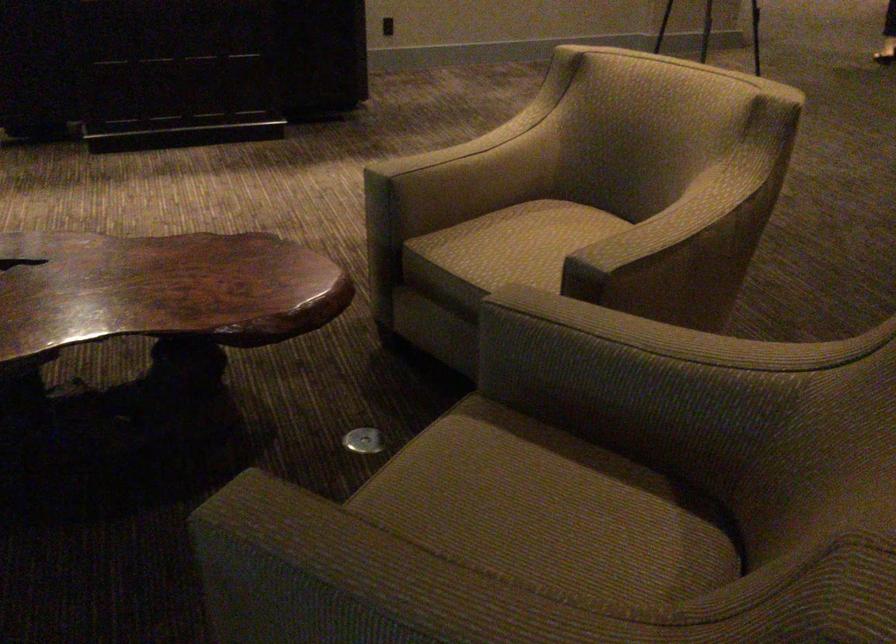
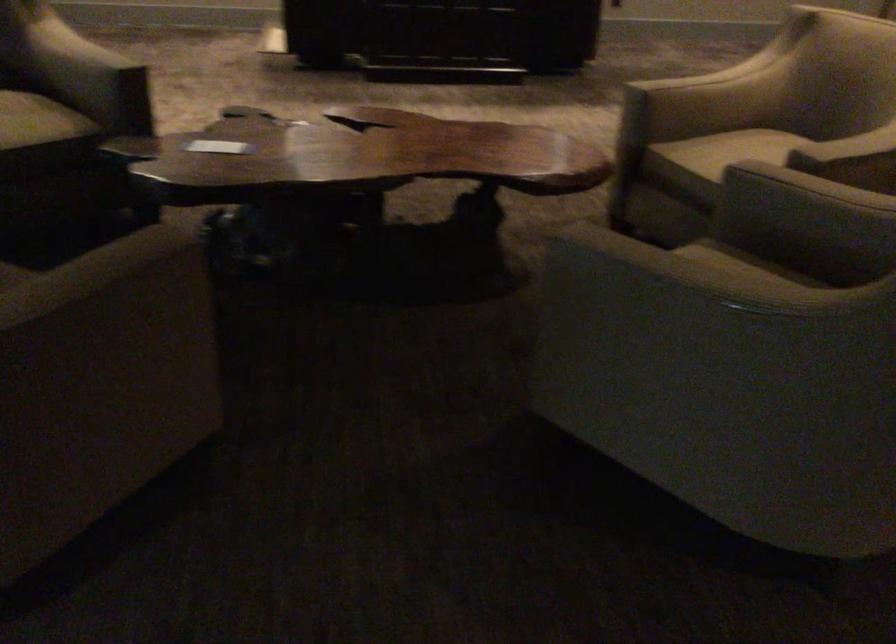
Where in the second image is the point corresponding to (x=510, y=238) from the first image?

(741, 149)